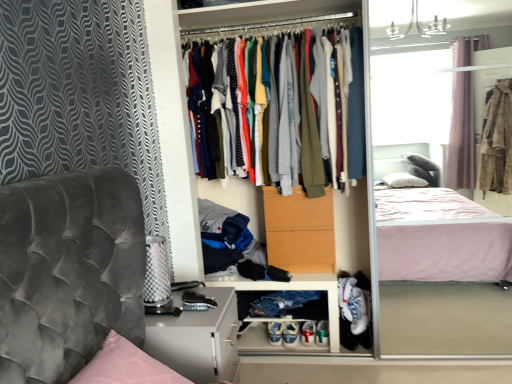
I want to click on vacant area on top of white plastic cabinet at lower center (from a real-world perspective), so click(x=281, y=277).